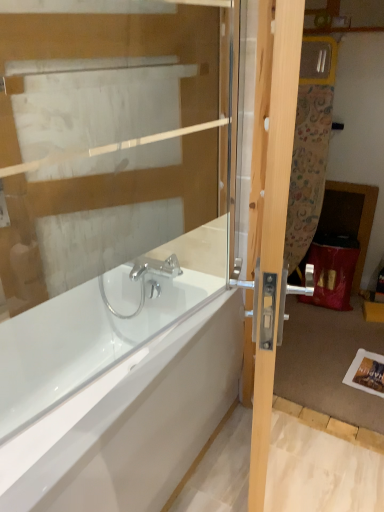
Question: Is transparent glass door at upper center touching light wood door at right?

Choices:
 (A) yes
 (B) no

Answer: (B)

Question: Is transparent glass door at upper center facing away from light wood door at right?

Choices:
 (A) no
 (B) yes

Answer: (B)

Question: From the image's perspective, is transparent glass door at upper center over light wood door at right?

Choices:
 (A) no
 (B) yes

Answer: (B)

Question: Can you confirm if transparent glass door at upper center is thinner than light wood door at right?

Choices:
 (A) yes
 (B) no

Answer: (A)

Question: Is the depth of transparent glass door at upper center greater than that of light wood door at right?

Choices:
 (A) no
 (B) yes

Answer: (B)

Question: Could you tell me if transparent glass door at upper center is facing light wood door at right?

Choices:
 (A) no
 (B) yes

Answer: (B)

Question: Considering the relative sizes of light wood door at right and transparent glass door at upper center in the image provided, is light wood door at right bigger than transparent glass door at upper center?

Choices:
 (A) yes
 (B) no

Answer: (A)

Question: Is light wood door at right smaller than transparent glass door at upper center?

Choices:
 (A) no
 (B) yes

Answer: (A)

Question: From a real-world perspective, is light wood door at right positioned under transparent glass door at upper center based on gravity?

Choices:
 (A) no
 (B) yes

Answer: (B)

Question: Considering the relative sizes of light wood door at right and transparent glass door at upper center in the image provided, is light wood door at right wider than transparent glass door at upper center?

Choices:
 (A) yes
 (B) no

Answer: (A)

Question: Is light wood door at right facing towards transparent glass door at upper center?

Choices:
 (A) yes
 (B) no

Answer: (A)

Question: Is light wood door at right in front of transparent glass door at upper center?

Choices:
 (A) yes
 (B) no

Answer: (A)

Question: Is light wood door at right with white glossy bathtub at center?

Choices:
 (A) no
 (B) yes

Answer: (A)